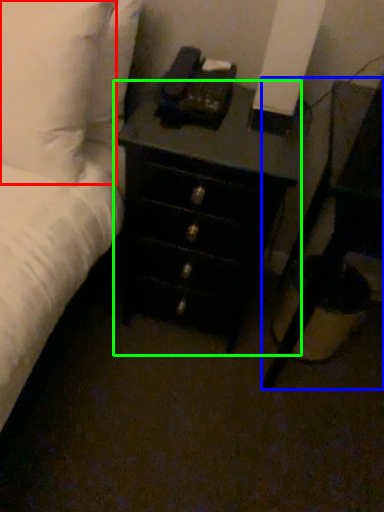
Question: Based on their relative distances, which object is farther from pillow (highlighted by a red box)? Choose from nightstand (highlighted by a blue box) and chest of drawers (highlighted by a green box).

Choices:
 (A) nightstand
 (B) chest of drawers

Answer: (A)